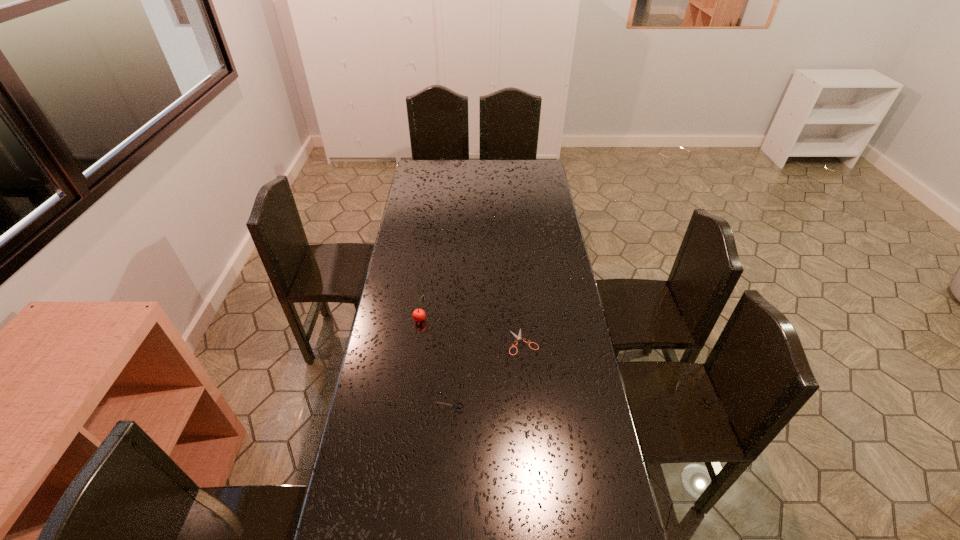
Find the location of a particular element. This screenshot has width=960, height=540. blank region between the farthest object and the second farthest object is located at coordinates (471, 330).

You are a GUI agent. You are given a task and a screenshot of the screen. Output one action in this format:
    pyautogui.click(x=<x>, y=<y>)
    Task: Click on the unoccupied position between the rightmost object and the taller shears
    The height and width of the screenshot is (540, 960).
    Given the screenshot: What is the action you would take?
    pyautogui.click(x=486, y=374)

In order to click on vacant area between the shorter shears and the tallest object in this screenshot , I will do `click(471, 330)`.

The height and width of the screenshot is (540, 960). Find the location of `vacant point located between the shorter shears and the cherry`. vacant point located between the shorter shears and the cherry is located at coordinates (471, 330).

In order to click on free area in between the leftmost object and the taller shears in this screenshot , I will do `click(435, 363)`.

Select which object is the closest to the rightmost object. Please provide its 2D coordinates. Your answer should be formatted as a tuple, i.e. [(x, y)], where the tuple contains the x and y coordinates of a point satisfying the conditions above.

[(456, 406)]

In order to click on the second closest object to the leftmost object in this screenshot , I will do `click(456, 406)`.

At what (x,y) coordinates should I click in order to perform the action: click on vacant position in the image that satisfies the following two spatial constraints: 1. on the front side of the cherry; 2. on the right side of the shorter shears. Please return your answer as a coordinate pair (x, y). This screenshot has width=960, height=540. Looking at the image, I should click on (417, 342).